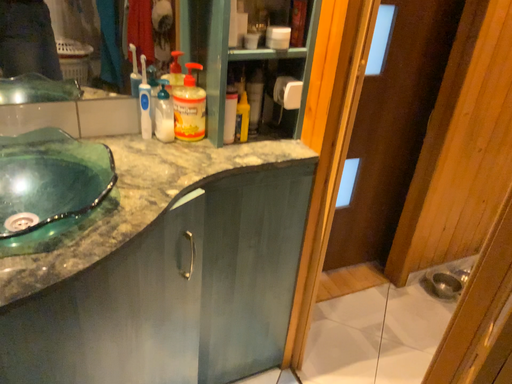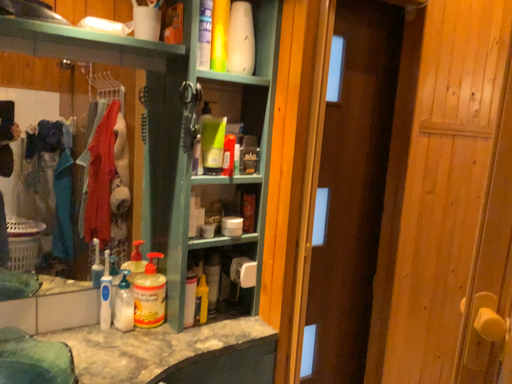
Question: How did the camera likely rotate when shooting the video?

Choices:
 (A) rotated upward
 (B) rotated downward

Answer: (A)